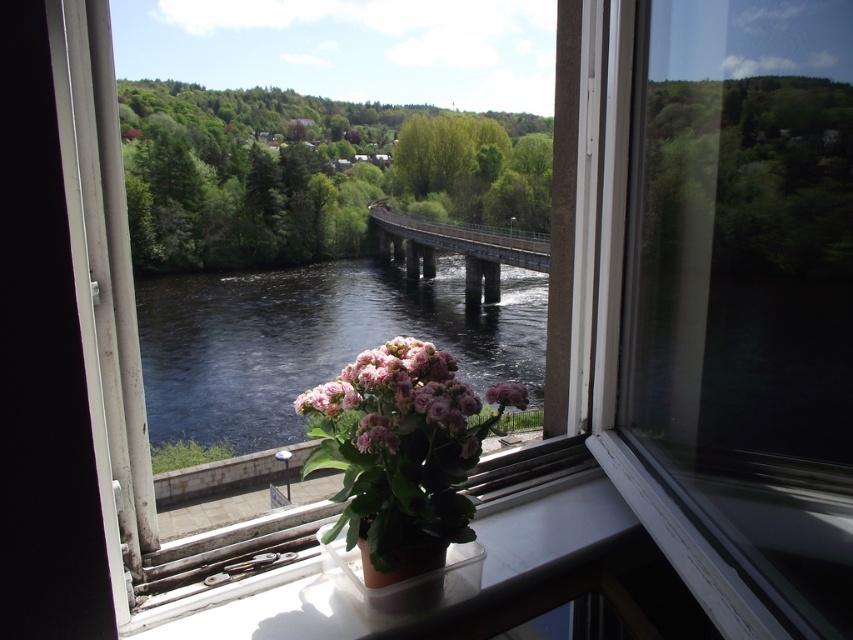
Question: Based on their relative distances, which object is farther from the dark blue water at center?

Choices:
 (A) concrete bridge at center
 (B) plastic/transparent pot at bottom

Answer: (B)

Question: Does dark blue water at center appear over pink matte flower at center?

Choices:
 (A) no
 (B) yes

Answer: (B)

Question: Which object is closer to the camera taking this photo?

Choices:
 (A) dark blue water at center
 (B) plastic/transparent pot at bottom
 (C) pink matte flower at center
 (D) concrete bridge at center

Answer: (C)

Question: Does pink matte flower at center appear over concrete bridge at center?

Choices:
 (A) yes
 (B) no

Answer: (B)

Question: Can you confirm if pink matte flower at center is positioned below plastic/transparent pot at bottom?

Choices:
 (A) yes
 (B) no

Answer: (B)

Question: Which point is closer to the camera taking this photo?

Choices:
 (A) (296, 420)
 (B) (364, 362)
 (C) (444, 557)

Answer: (B)